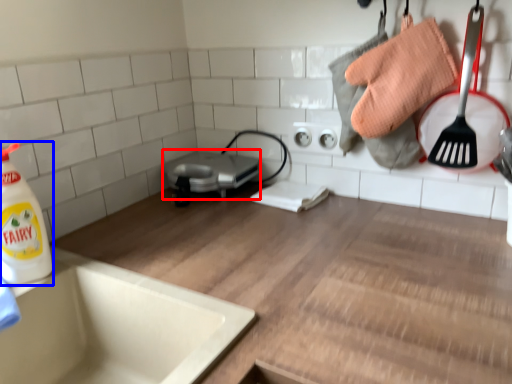
Question: Which of the following is the closest to the observer, appliance (highlighted by a red box) or cleaning product (highlighted by a blue box)?

Choices:
 (A) appliance
 (B) cleaning product

Answer: (B)